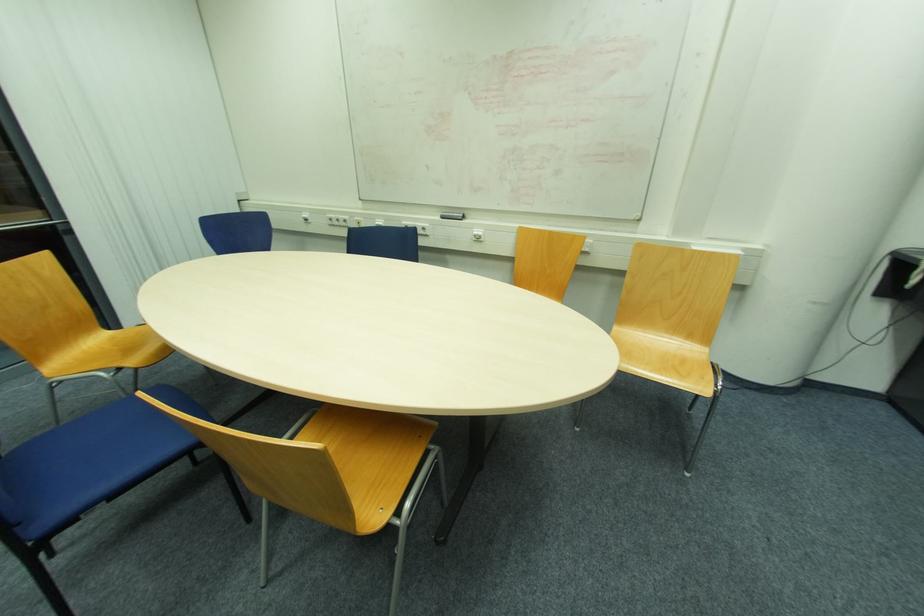
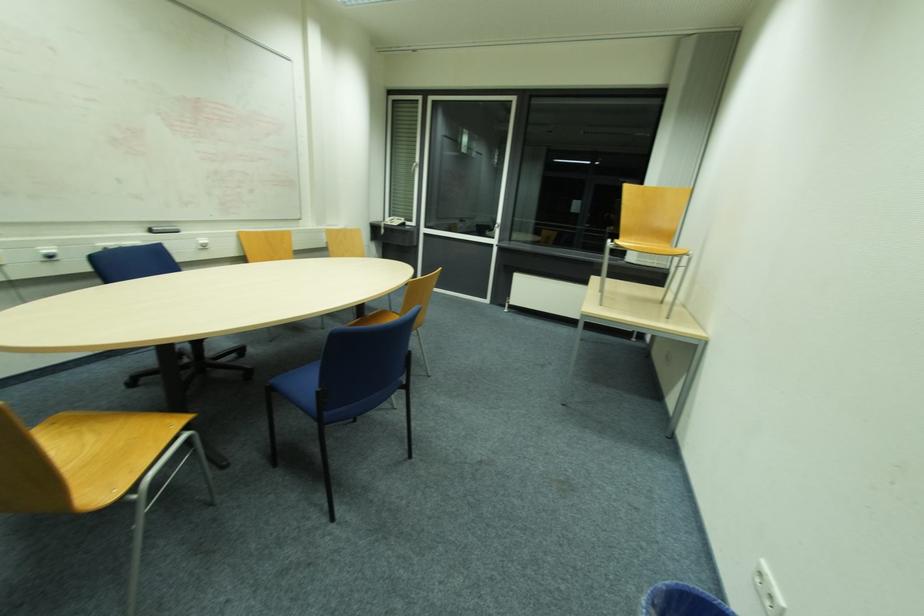
In the second image, find the point that corresponds to point (446, 211) in the first image.

(151, 227)